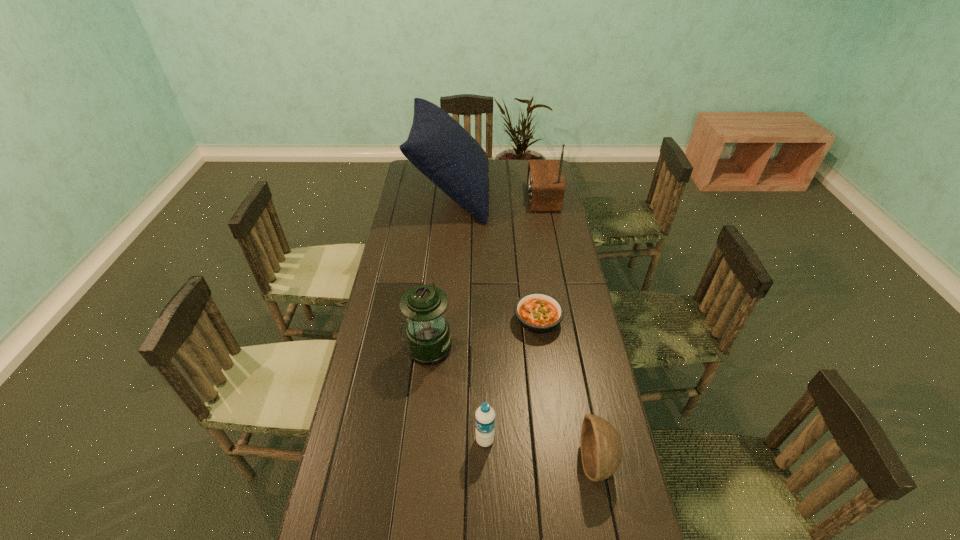
Where is `bowl located at the right edge`? bowl located at the right edge is located at coordinates pos(601,448).

Where is `stew that is at the right edge`? The width and height of the screenshot is (960, 540). stew that is at the right edge is located at coordinates (539, 313).

Where is `object that is at the far left corner`? The height and width of the screenshot is (540, 960). object that is at the far left corner is located at coordinates (438, 146).

In the image, there is a desktop. At what (x,y) coordinates should I click in order to perform the action: click on vacant space at the left edge. Please return your answer as a coordinate pair (x, y). Image resolution: width=960 pixels, height=540 pixels. Looking at the image, I should click on (362, 538).

In the image, there is a desktop. At what (x,y) coordinates should I click in order to perform the action: click on vacant space at the right edge. Please return your answer as a coordinate pair (x, y). Image resolution: width=960 pixels, height=540 pixels. Looking at the image, I should click on (620, 534).

Find the location of a particular element. vacant region between the water bottle and the radio receiver is located at coordinates (514, 319).

The image size is (960, 540). In order to click on free space between the bowl and the water bottle in this screenshot , I will do `click(540, 451)`.

What are the coordinates of `vacant space that's between the water bottle and the radio receiver` in the screenshot? It's located at (514, 319).

Locate an element on the screen. This screenshot has width=960, height=540. vacant area that lies between the shortest object and the bowl is located at coordinates (567, 392).

This screenshot has height=540, width=960. I want to click on free space between the water bottle and the stew, so point(512,381).